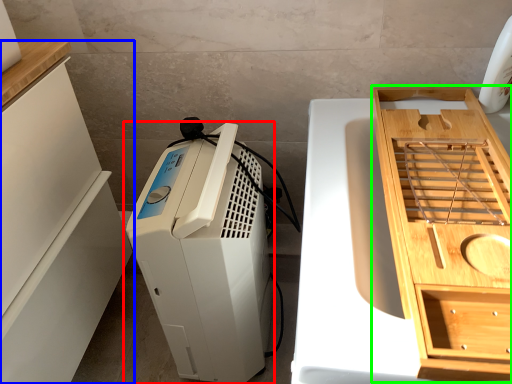
Question: Which object is the farthest from home appliance (highlighted by a red box)? Choose among these: cabinetry (highlighted by a blue box) or cabinetry (highlighted by a green box).

Choices:
 (A) cabinetry
 (B) cabinetry

Answer: (B)